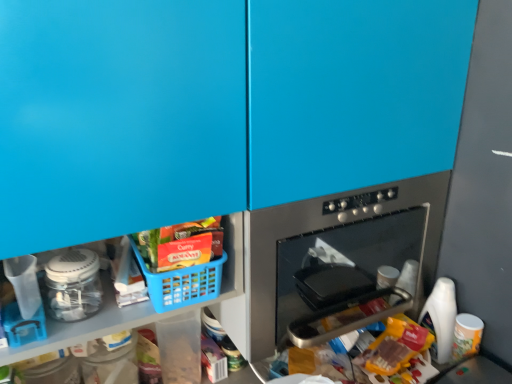
Question: Would you say blue plastic basket at lower left is part of stainless steel oven at center's contents?

Choices:
 (A) no
 (B) yes

Answer: (A)

Question: Is stainless steel oven at center not inside blue plastic basket at lower left?

Choices:
 (A) yes
 (B) no

Answer: (A)

Question: From the image's perspective, does stainless steel oven at center appear higher than blue plastic basket at lower left?

Choices:
 (A) no
 (B) yes

Answer: (B)

Question: Can you confirm if stainless steel oven at center is shorter than blue plastic basket at lower left?

Choices:
 (A) no
 (B) yes

Answer: (A)

Question: From a real-world perspective, is stainless steel oven at center located higher than blue plastic basket at lower left?

Choices:
 (A) no
 (B) yes

Answer: (A)

Question: Is stainless steel oven at center at the right side of blue plastic basket at lower left?

Choices:
 (A) no
 (B) yes

Answer: (B)

Question: From a real-world perspective, is stainless steel oven at center over white plastic bottle at lower right?

Choices:
 (A) yes
 (B) no

Answer: (A)

Question: Would you consider stainless steel oven at center to be distant from white plastic bottle at lower right?

Choices:
 (A) yes
 (B) no

Answer: (B)

Question: Does stainless steel oven at center lie in front of white plastic bottle at lower right?

Choices:
 (A) yes
 (B) no

Answer: (A)

Question: Is stainless steel oven at center not within white plastic bottle at lower right?

Choices:
 (A) yes
 (B) no

Answer: (A)

Question: Is stainless steel oven at center beside white plastic bottle at lower right?

Choices:
 (A) no
 (B) yes

Answer: (A)

Question: Considering the relative sizes of stainless steel oven at center and white plastic bottle at lower right in the image provided, is stainless steel oven at center bigger than white plastic bottle at lower right?

Choices:
 (A) no
 (B) yes

Answer: (B)

Question: Is translucent plastic bag at lower center, arranged as the first food when ordered from the bottom, taller than matte plastic basket at lower center, positioned as the first food in top-to-bottom order?

Choices:
 (A) no
 (B) yes

Answer: (B)